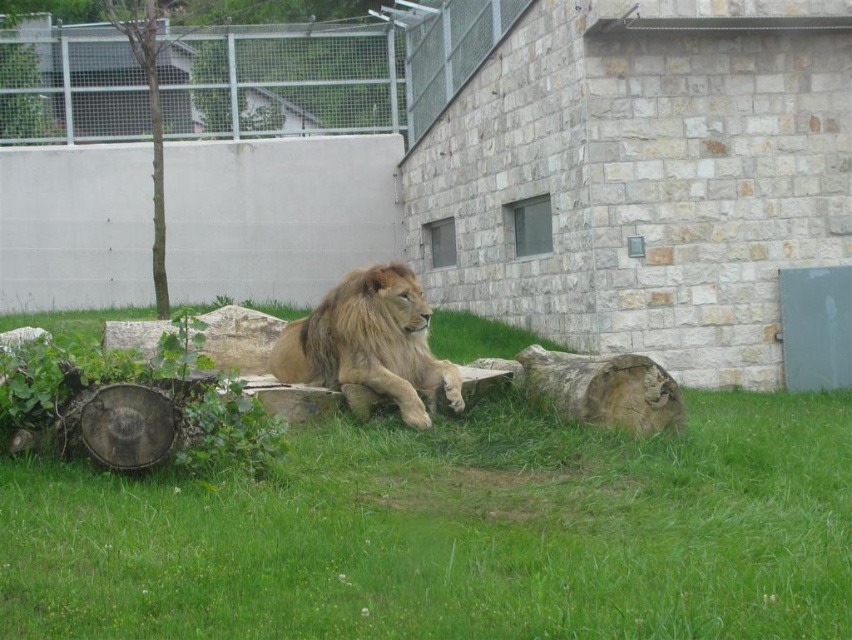
Question: Which point is farther to the camera?

Choices:
 (A) green grass at center
 (B) golden fur lion at center

Answer: (A)

Question: In this image, where is green grass at center located relative to green bark tree at upper left?

Choices:
 (A) right
 (B) left

Answer: (A)

Question: Does green grass at center have a greater width compared to green bark tree at upper left?

Choices:
 (A) no
 (B) yes

Answer: (A)

Question: Which of these objects is positioned farthest from the golden fur lion at center?

Choices:
 (A) green grass at center
 (B) green bark tree at upper left

Answer: (B)

Question: Can you confirm if green grass at center is positioned below green bark tree at upper left?

Choices:
 (A) yes
 (B) no

Answer: (A)

Question: Which of the following is the farthest from the observer?

Choices:
 (A) (317, 378)
 (B) (154, 180)

Answer: (B)